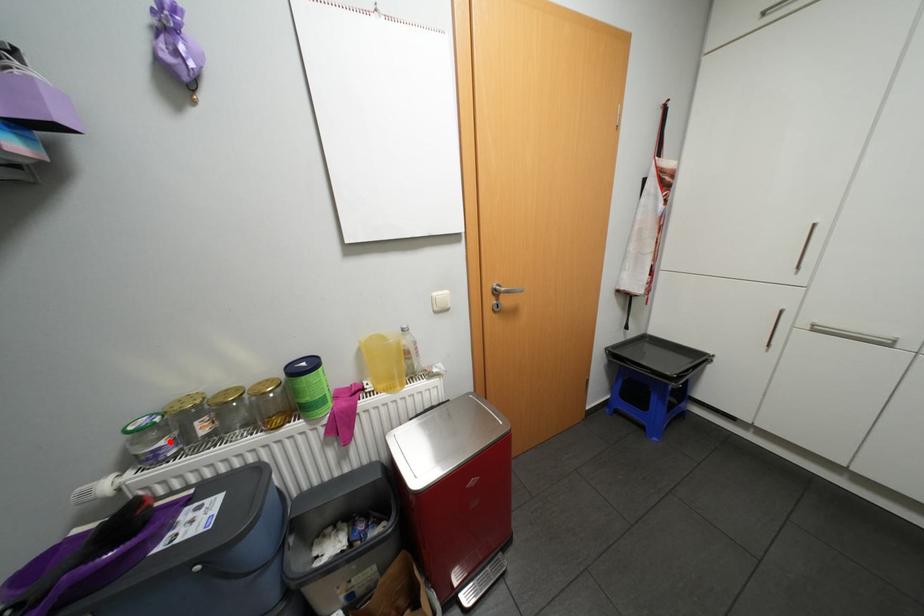
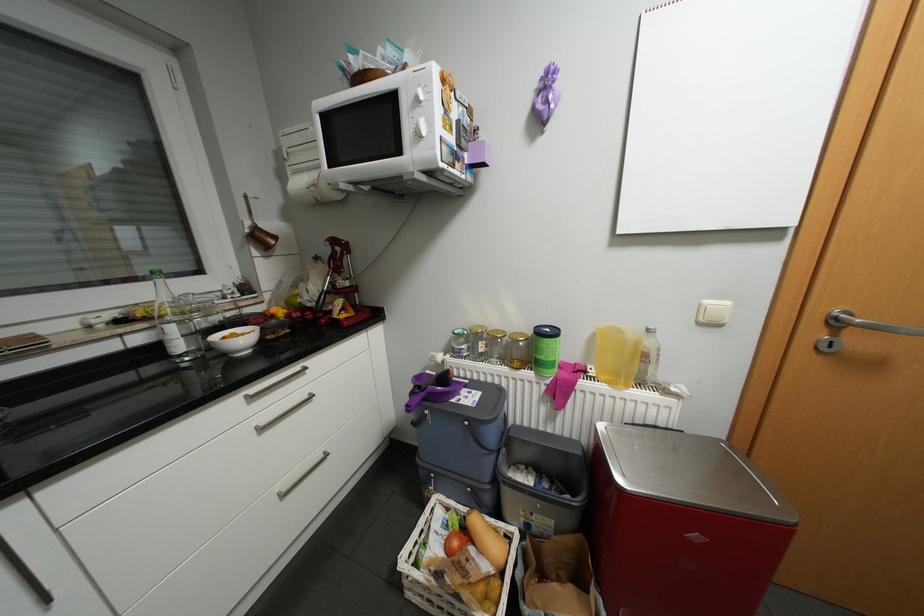
Where in the second image is the point corresponding to the highlighted location from the first image?

(471, 345)